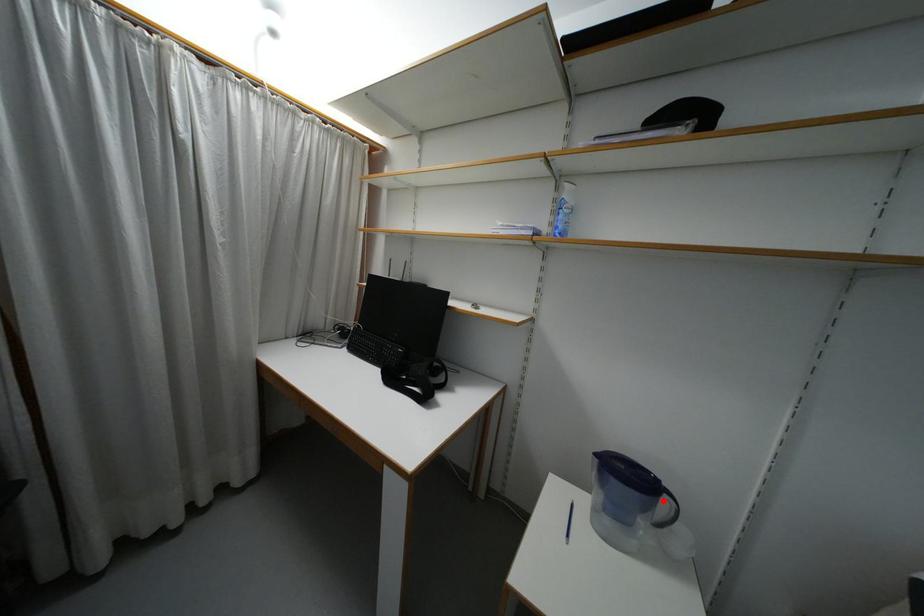
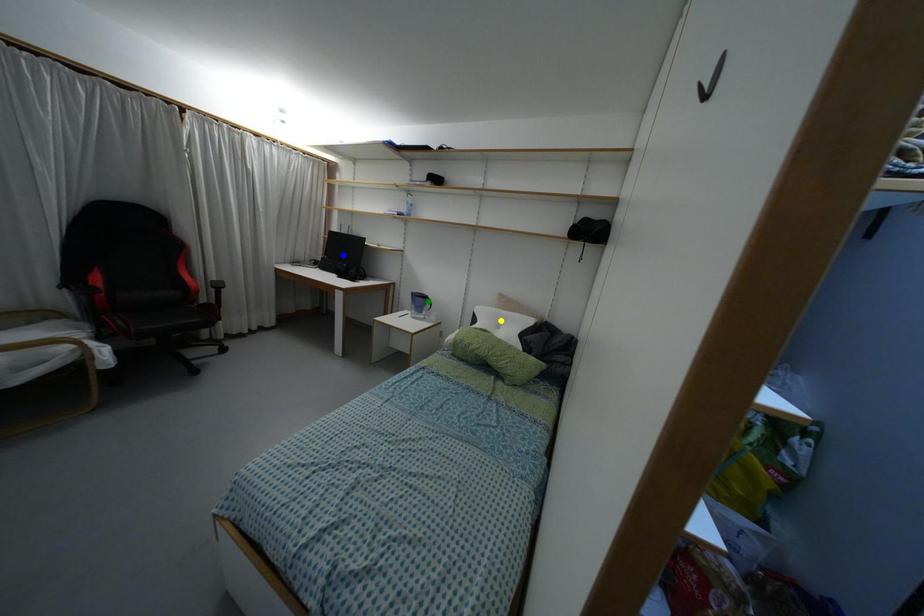
Question: I am providing you with two images of the same scene from different viewpoints. A red point is marked on the first image. You are given multiple points on the second image. In image 2, which mark is for the same physical point as the one in image 1?

Choices:
 (A) yellow point
 (B) green point
 (C) blue point

Answer: (B)